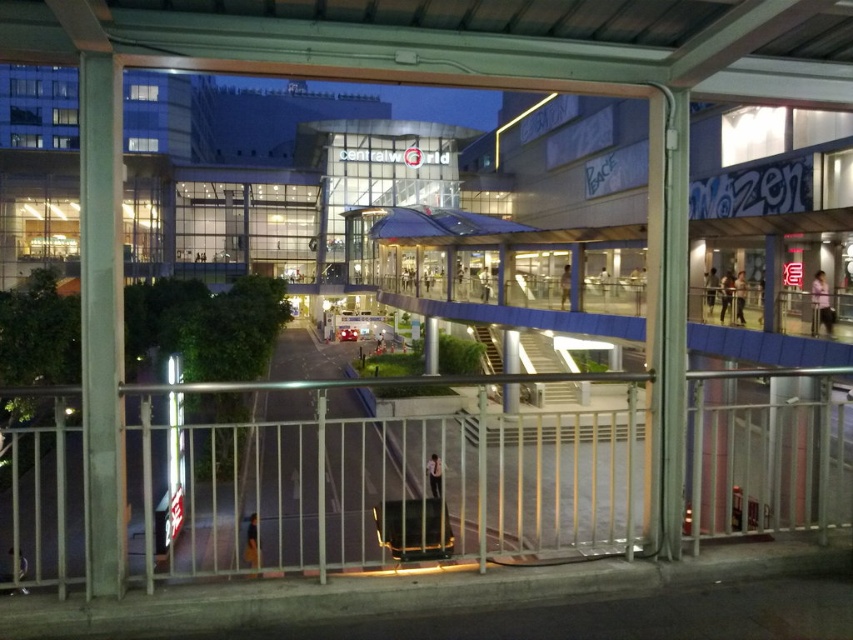
Question: Which object is closer to the camera taking this photo?

Choices:
 (A) metallic silver railing at center
 (B) concrete pillar at left

Answer: (B)

Question: Which point is farther from the camera taking this photo?

Choices:
 (A) (119, 381)
 (B) (630, 500)

Answer: (B)

Question: From the image, what is the correct spatial relationship of metallic silver railing at center in relation to concrete pillar at left?

Choices:
 (A) above
 (B) below

Answer: (B)

Question: Is metallic silver railing at center bigger than concrete pillar at left?

Choices:
 (A) yes
 (B) no

Answer: (B)

Question: Does metallic silver railing at center appear over concrete pillar at left?

Choices:
 (A) yes
 (B) no

Answer: (B)